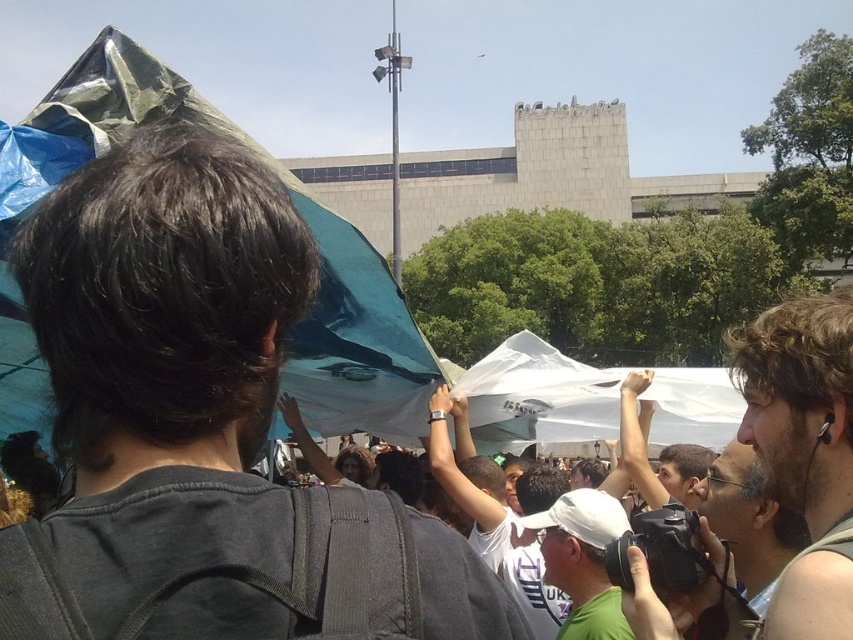
Does gray fabric earphones at right have a greater width compared to gray tank top at lower right?

Correct, the width of gray fabric earphones at right exceeds that of gray tank top at lower right.

Consider the image. Is gray fabric earphones at right shorter than gray tank top at lower right?

Incorrect, gray fabric earphones at right's height does not fall short of gray tank top at lower right's.

Between point (808, 497) and point (740, 547), which one is positioned behind?

Positioned behind is point (740, 547).

Identify the location of gray fabric earphones at right. Image resolution: width=853 pixels, height=640 pixels. (804, 451).

Is white matte cap at center smaller than gray tank top at lower right?

Indeed, white matte cap at center has a smaller size compared to gray tank top at lower right.

This screenshot has height=640, width=853. What do you see at coordinates (583, 561) in the screenshot?
I see `white matte cap at center` at bounding box center [583, 561].

Find the location of `white matte cap at center`. white matte cap at center is located at coordinates (583, 561).

Between point (840, 564) and point (566, 637), which one is positioned in front?

Point (840, 564) is in front.

Does gray fabric earphones at right have a lesser width compared to white matte cap at center?

In fact, gray fabric earphones at right might be wider than white matte cap at center.

What do you see at coordinates (804, 451) in the screenshot? The height and width of the screenshot is (640, 853). I see `gray fabric earphones at right` at bounding box center [804, 451].

Where is `gray fabric earphones at right`? gray fabric earphones at right is located at coordinates (804, 451).